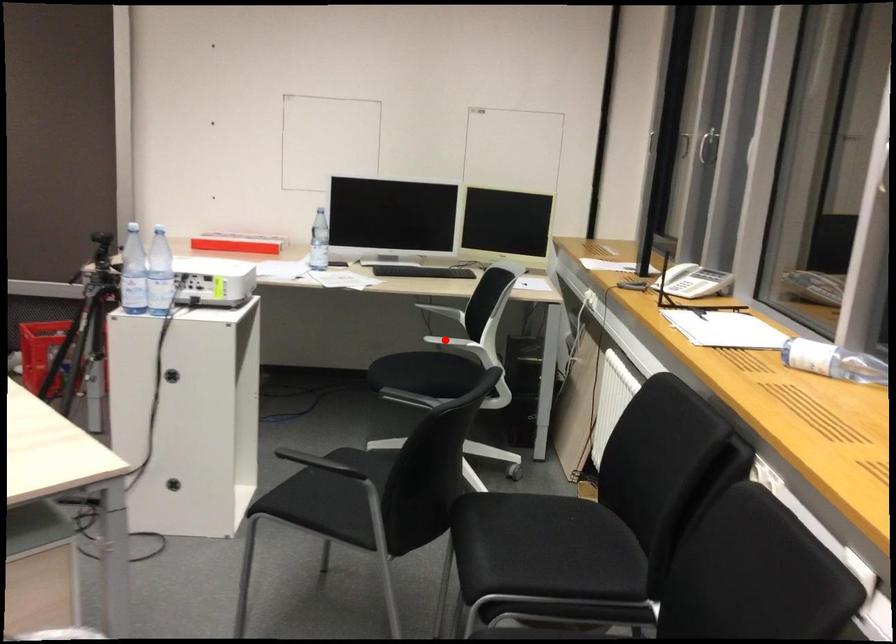
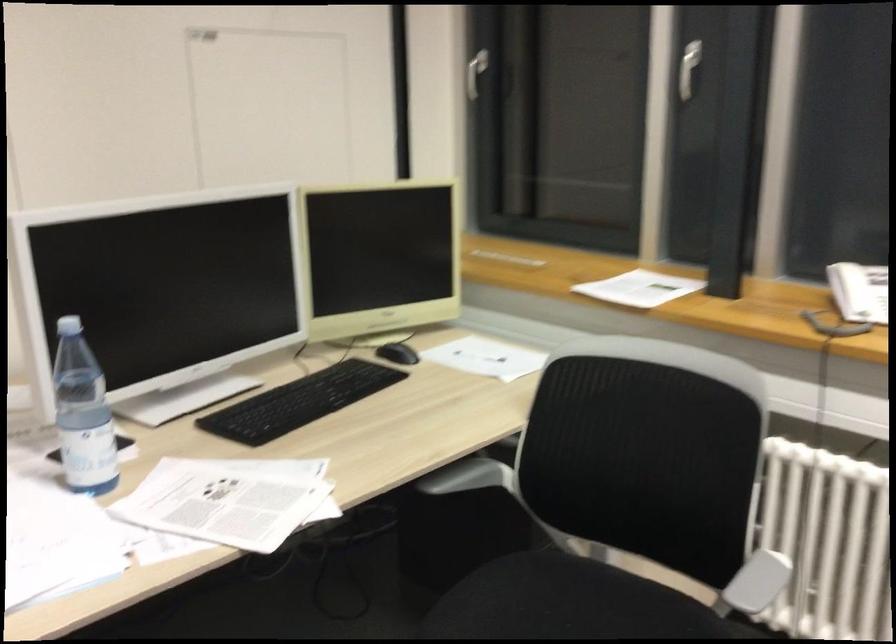
Question: I am providing you with two images of the same scene from different viewpoints. In image1, a red point is highlighted. Considering the same 3D point in image2, which of the following is correct?

Choices:
 (A) It is closer
 (B) It is farther

Answer: (A)